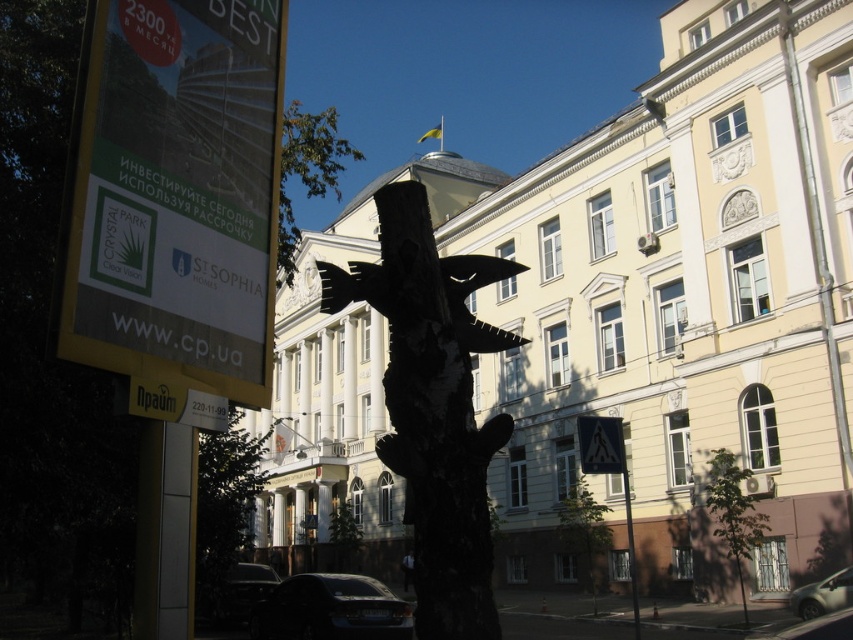
Can you confirm if yellow paper sign at upper left is taller than shiny black car at lower left?

Indeed, yellow paper sign at upper left has a greater height compared to shiny black car at lower left.

Is yellow paper sign at upper left wider than shiny black car at lower left?

Yes, yellow paper sign at upper left is wider than shiny black car at lower left.

You are a GUI agent. You are given a task and a screenshot of the screen. Output one action in this format:
    pyautogui.click(x=<x>, y=<y>)
    Task: Click on the yellow paper sign at upper left
    The height and width of the screenshot is (640, 853).
    Given the screenshot: What is the action you would take?
    pyautogui.click(x=175, y=195)

Can you confirm if black plastic triangle at lower right is wider than metallic pole at lower right?

Yes, black plastic triangle at lower right is wider than metallic pole at lower right.

Between point (602, 420) and point (630, 566), which one is positioned behind?

The point (630, 566) is more distant.

Where is `black plastic triangle at lower right`? The height and width of the screenshot is (640, 853). black plastic triangle at lower right is located at coordinates (608, 474).

Does dark matte car at lower center have a lesser width compared to green leafy tree at upper center?

Yes, dark matte car at lower center is thinner than green leafy tree at upper center.

Which is in front, point (318, 573) or point (311, 150)?

Point (318, 573) is in front.

What do you see at coordinates (329, 609) in the screenshot? The height and width of the screenshot is (640, 853). I see `dark matte car at lower center` at bounding box center [329, 609].

In order to click on dark matte car at lower center in this screenshot , I will do [x=329, y=609].